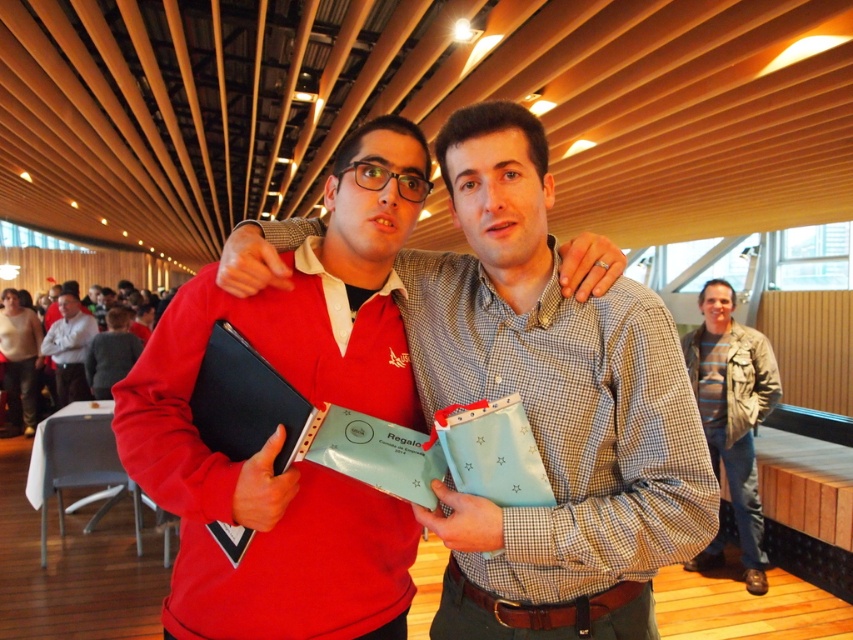
You are organizing a presentation and need to place the matte black laptop at center on a shelf next to the striped cotton shirt at right. If the shelf has a height limit of 10 cm, can both items be placed there?

The matte black laptop at center has a lesser height compared to striped cotton shirt at right. Since the striped cotton shirt at right is taller, but the exact height isn t specified, we can t confirm if it exceeds the 10 cm limit. However, the laptop s lesser height might fit. Further information is needed about both items heights.

You are organizing a tech event and need to place a matte black laptop at center on a table that can only accommodate items narrower than the light gray shirt at center. Based on the image, can the laptop fit on the table?

The matte black laptop at center might be wider than light gray shirt at center, so there is a possibility that it won not fit on the table if the table can only accommodate items narrower than the light gray shirt at center.

You are organizing a meeting in a room and need to locate the matte black laptop at center. The room has a coordinate system where the bottom left corner is the origin. Can you confirm if the matte black laptop at center is located at point (x=550, y=406)?

Yes, the point (x=550, y=406) corresponds to the matte black laptop at center, so it is located there.